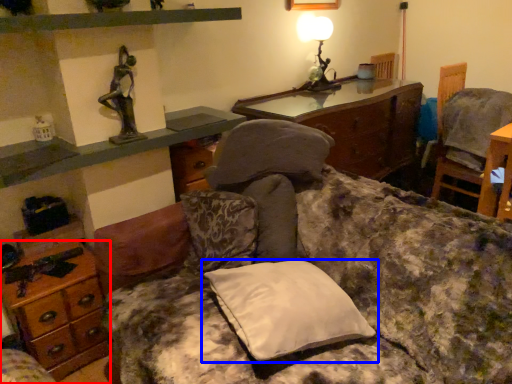
Question: Which object is closer to the camera taking this photo, desk (highlighted by a red box) or pillow (highlighted by a blue box)?

Choices:
 (A) desk
 (B) pillow

Answer: (B)